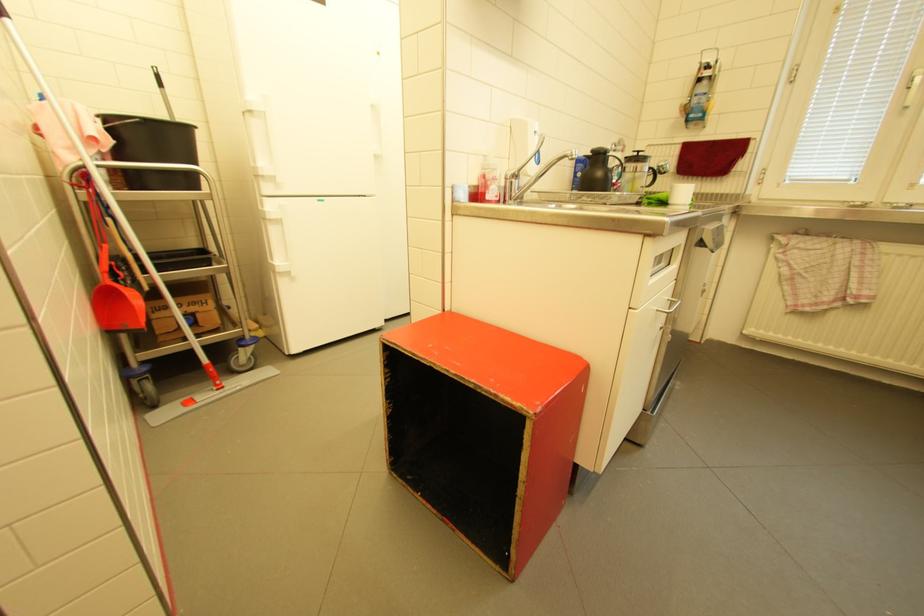
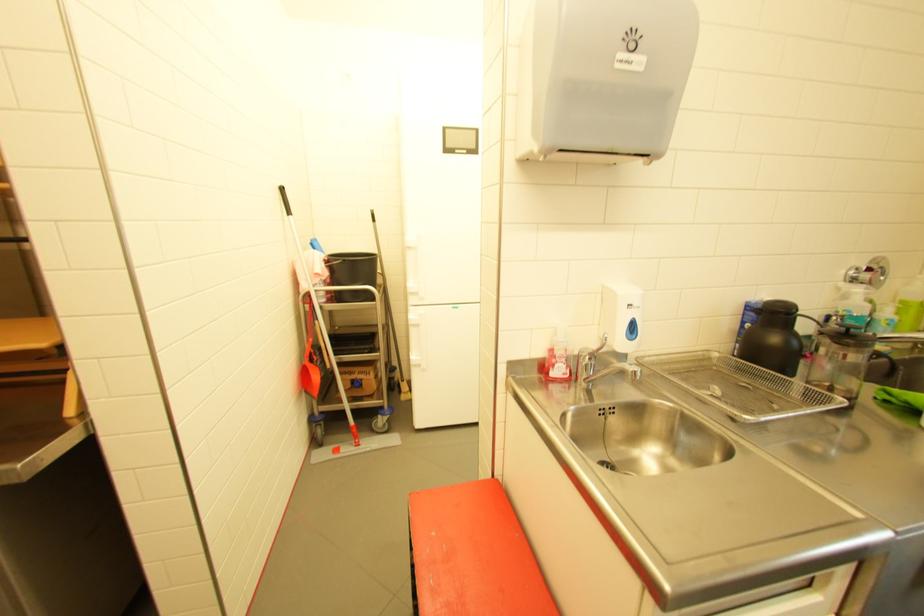
Find the pixel in the second image that matches point (606, 175) in the first image.

(782, 339)